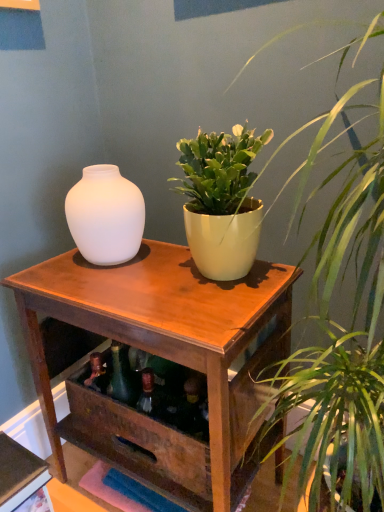
Question: Is wooden table at center situated inside matte white vase at left or outside?

Choices:
 (A) inside
 (B) outside

Answer: (B)

Question: From the image's perspective, is wooden table at center located above or below matte white vase at left?

Choices:
 (A) above
 (B) below

Answer: (B)

Question: Based on their relative distances, which object is farther from the matte white vase at left?

Choices:
 (A) matte yellow pot at upper center, marked as the 2th houseplant in a top-to-bottom arrangement
 (B) green matte plant pot at center, the 2th houseplant when ordered from bottom to top
 (C) wooden table at center

Answer: (A)

Question: Estimate the real-world distances between objects in this image. Which object is closer to the matte yellow pot at upper center, placed as the 1th houseplant when sorted from bottom to top?

Choices:
 (A) matte white vase at left
 (B) wooden table at center
 (C) green matte plant pot at center, the 2th houseplant when ordered from bottom to top

Answer: (C)